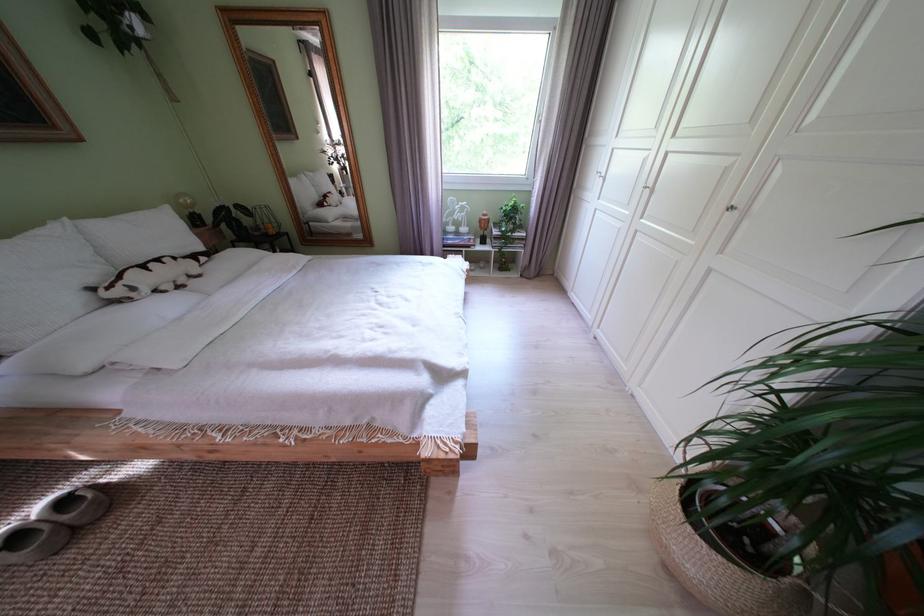
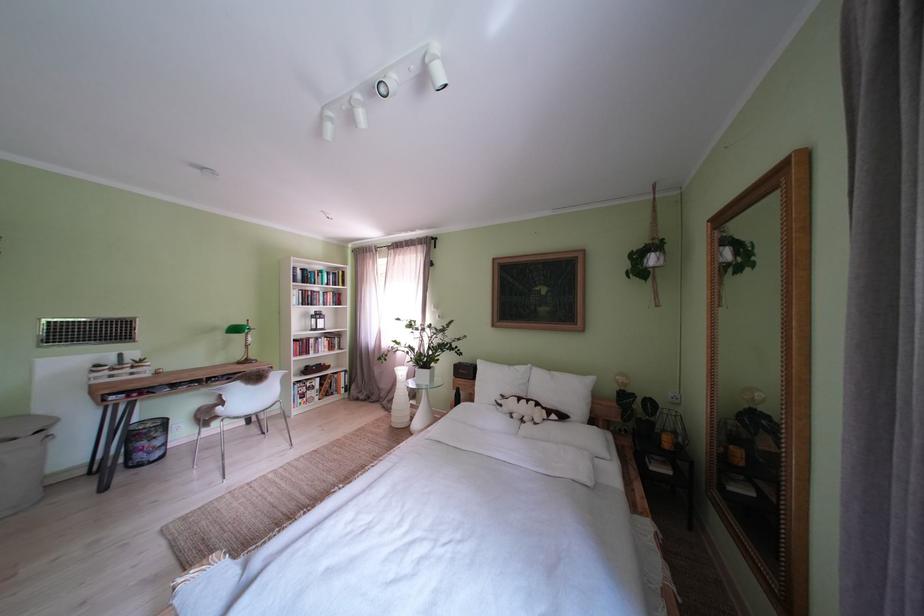
The point at (146, 294) is marked in the first image. Where is the corresponding point in the second image?

(512, 411)